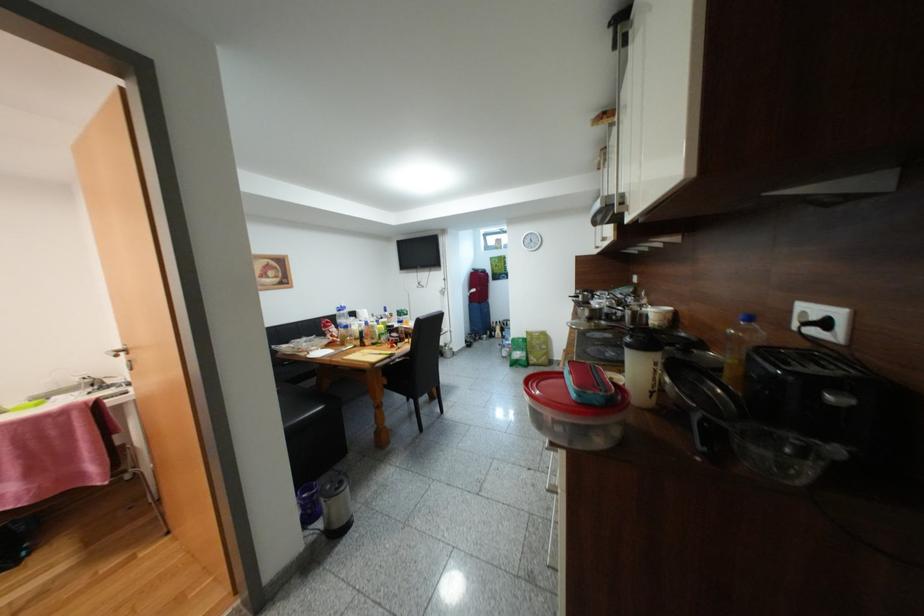
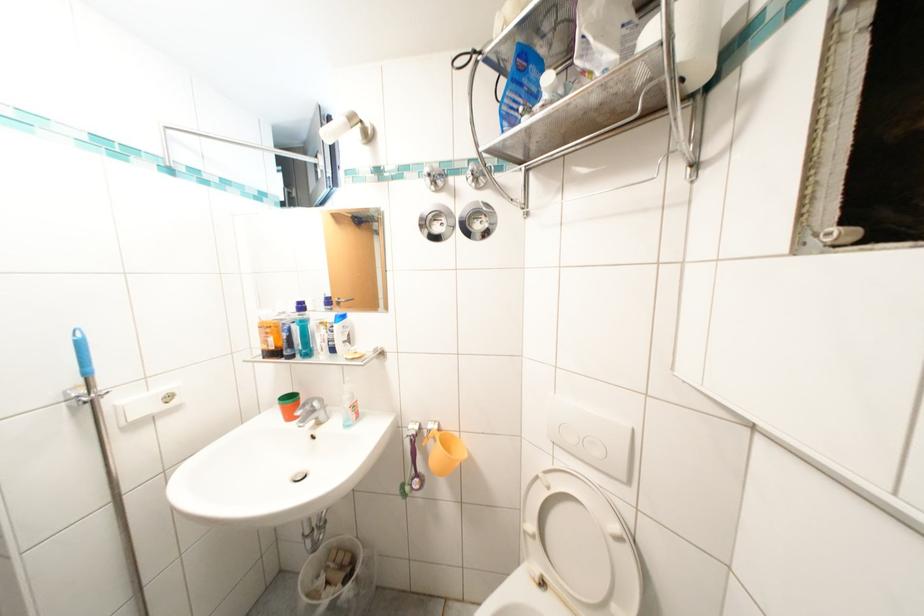
Question: Which direction would the cameraman need to move to produce the second image? Reply with the corresponding letter.

Choices:
 (A) Left
 (B) Right
 (C) Forward
 (D) Backward

Answer: (B)